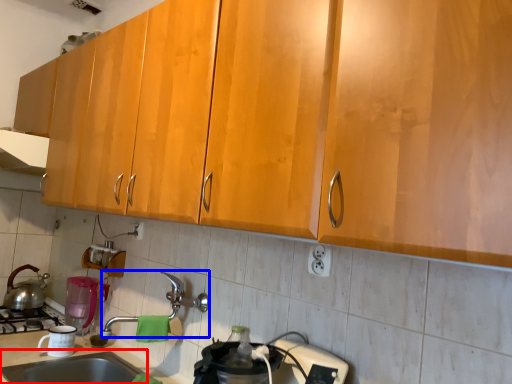
Question: Which object is further to the camera taking this photo, sink (highlighted by a red box) or faucet (highlighted by a blue box)?

Choices:
 (A) sink
 (B) faucet

Answer: (B)